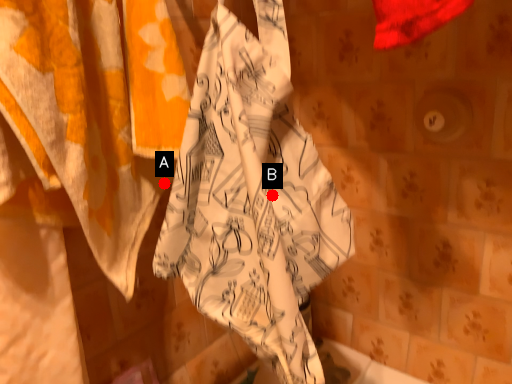
Question: Two points are circled on the image, labeled by A and B beside each circle. Which point appears farthest from the camera in this image?

Choices:
 (A) A is further
 (B) B is further

Answer: (A)